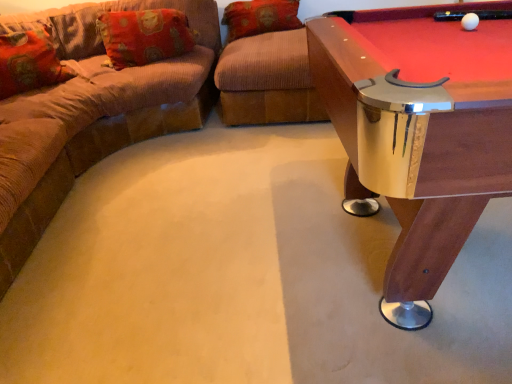
Question: From their relative heights in the image, would you say white glossy ball at upper right is taller or shorter than floral fabric pillow at left, which appears as the 1th pillow when viewed from the left?

Choices:
 (A) tall
 (B) short

Answer: (B)

Question: In terms of size, does white glossy ball at upper right appear bigger or smaller than floral fabric pillow at left, positioned as the third pillow in right-to-left order?

Choices:
 (A) big
 (B) small

Answer: (B)

Question: Estimate the real-world distances between objects in this image. Which object is closer to the brown corduroy ottoman at center?

Choices:
 (A) orange fabric pillow at upper left, which is the 2th pillow in right-to-left order
 (B) floral fabric pillow at left, positioned as the third pillow in right-to-left order
 (C) white glossy ball at upper right
 (D) wooden pool table at right
 (E) orange corduroy pillow at upper center, positioned as the 3th pillow in left-to-right order

Answer: (E)

Question: Which object is positioned farthest from the wooden pool table at right?

Choices:
 (A) orange corduroy pillow at upper center, positioned as the 3th pillow in left-to-right order
 (B) orange fabric pillow at upper left, which is the 2th pillow in right-to-left order
 (C) floral fabric pillow at left, positioned as the third pillow in right-to-left order
 (D) brown corduroy couch at left
 (E) brown corduroy ottoman at center

Answer: (A)